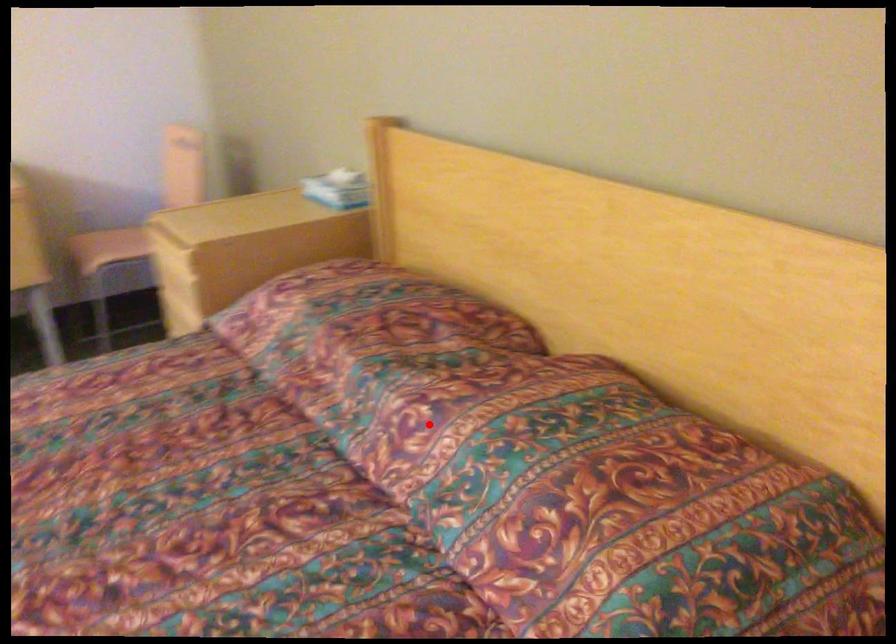
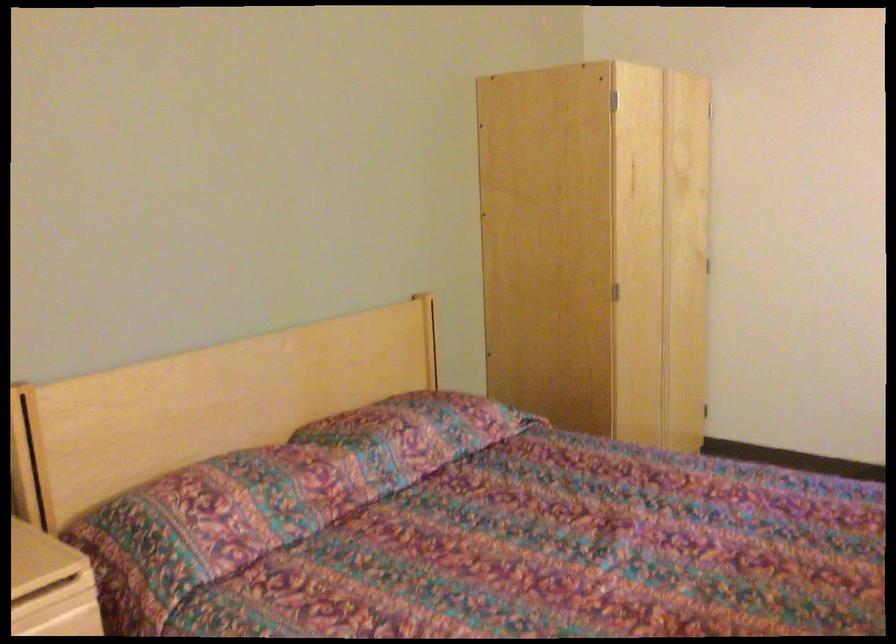
Locate, in the second image, the point that corresponds to the highlighted location in the first image.

(414, 433)